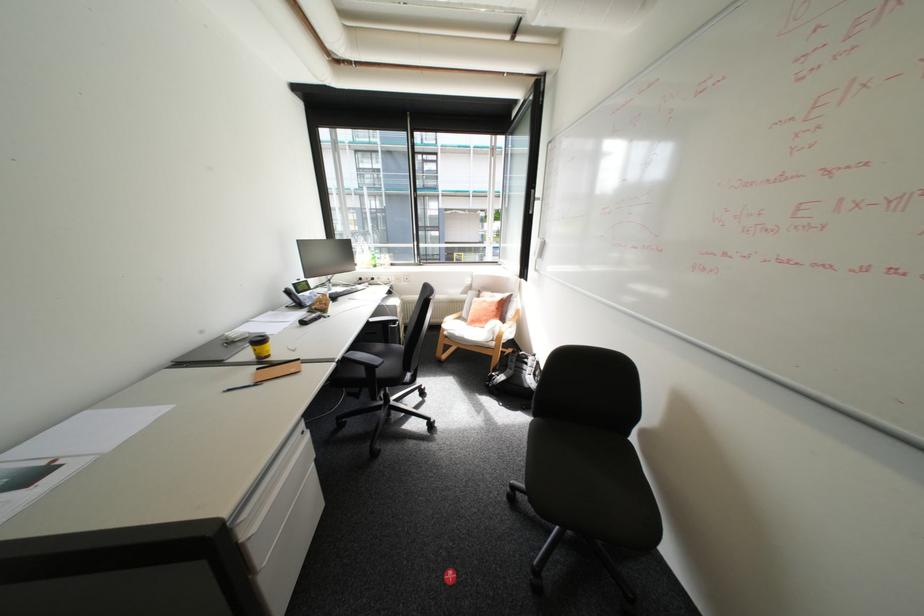
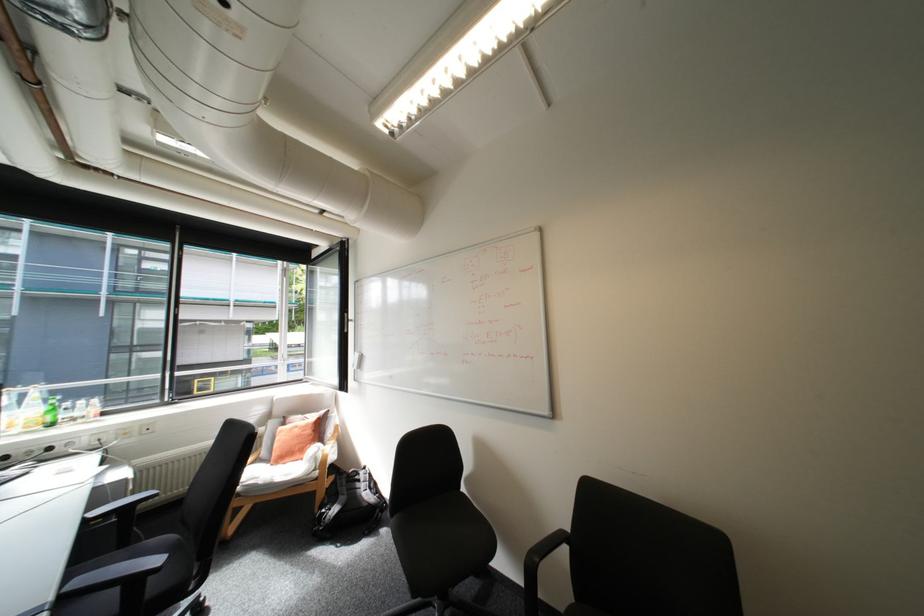
Where in the second image is the point corresponding to point 381,256 from the first image?

(55, 408)